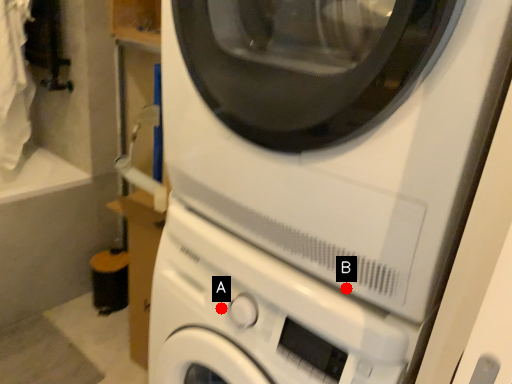
Question: Two points are circled on the image, labeled by A and B beside each circle. Which point is further to the camera?

Choices:
 (A) A is further
 (B) B is further

Answer: (A)